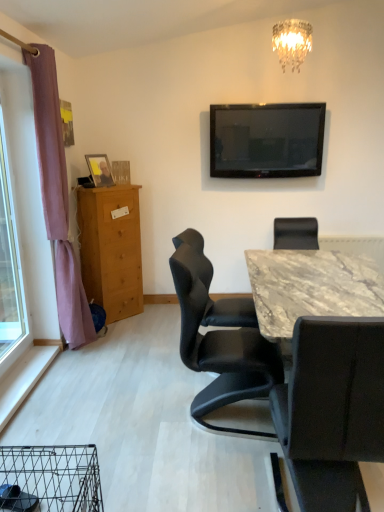
Question: Can you confirm if black leather chair at center, the second chair in the left-to-right sequence, is wider than black leather chair at center, which is the 1th chair from left to right?

Choices:
 (A) yes
 (B) no

Answer: (A)

Question: Can you confirm if black leather chair at center, positioned as the 1th chair in right-to-left order, is shorter than black leather chair at center, arranged as the second chair when viewed from the right?

Choices:
 (A) no
 (B) yes

Answer: (B)

Question: From a real-world perspective, is black leather chair at center, positioned as the 1th chair in right-to-left order, on top of black leather chair at center, which is the 1th chair from left to right?

Choices:
 (A) no
 (B) yes

Answer: (A)

Question: Does black leather chair at center, the second chair in the left-to-right sequence, appear on the left side of black leather chair at center, which is the 1th chair from left to right?

Choices:
 (A) yes
 (B) no

Answer: (B)

Question: From the image's perspective, would you say black leather chair at center, positioned as the 1th chair in right-to-left order, is positioned over black leather chair at center, which is the 1th chair from left to right?

Choices:
 (A) yes
 (B) no

Answer: (B)

Question: Based on their sizes in the image, would you say flat-screen tv at upper center is bigger or smaller than light brown wooden chest of drawers at left?

Choices:
 (A) big
 (B) small

Answer: (B)

Question: Choose the correct answer: Is flat-screen tv at upper center inside light brown wooden chest of drawers at left or outside it?

Choices:
 (A) inside
 (B) outside

Answer: (B)

Question: Considering their positions, is flat-screen tv at upper center located in front of or behind light brown wooden chest of drawers at left?

Choices:
 (A) behind
 (B) front

Answer: (A)

Question: From the image's perspective, relative to light brown wooden chest of drawers at left, is flat-screen tv at upper center above or below?

Choices:
 (A) below
 (B) above

Answer: (B)

Question: Considering the positions of black leather chair at center, which is the 1th chair from left to right, and black leather chair at center, positioned as the 1th chair in right-to-left order, in the image, is black leather chair at center, which is the 1th chair from left to right, bigger or smaller than black leather chair at center, positioned as the 1th chair in right-to-left order,?

Choices:
 (A) big
 (B) small

Answer: (B)

Question: Considering the positions of black leather chair at center, which is the 1th chair from left to right, and black leather chair at center, positioned as the 1th chair in right-to-left order, in the image, is black leather chair at center, which is the 1th chair from left to right, wider or thinner than black leather chair at center, positioned as the 1th chair in right-to-left order,?

Choices:
 (A) wide
 (B) thin

Answer: (B)

Question: Is black leather chair at center, which is the 1th chair from left to right, spatially inside black leather chair at center, positioned as the 1th chair in right-to-left order, or outside of it?

Choices:
 (A) outside
 (B) inside

Answer: (A)

Question: Visually, is black leather chair at center, arranged as the second chair when viewed from the right, positioned to the left or to the right of black leather chair at center, positioned as the 1th chair in right-to-left order?

Choices:
 (A) right
 (B) left

Answer: (B)

Question: Choose the correct answer: Is black leather chair at center, which is the 1th chair from left to right, inside purple fabric curtain at left or outside it?

Choices:
 (A) outside
 (B) inside

Answer: (A)

Question: Considering the positions of black leather chair at center, which is the 1th chair from left to right, and purple fabric curtain at left in the image, is black leather chair at center, which is the 1th chair from left to right, wider or thinner than purple fabric curtain at left?

Choices:
 (A) wide
 (B) thin

Answer: (A)